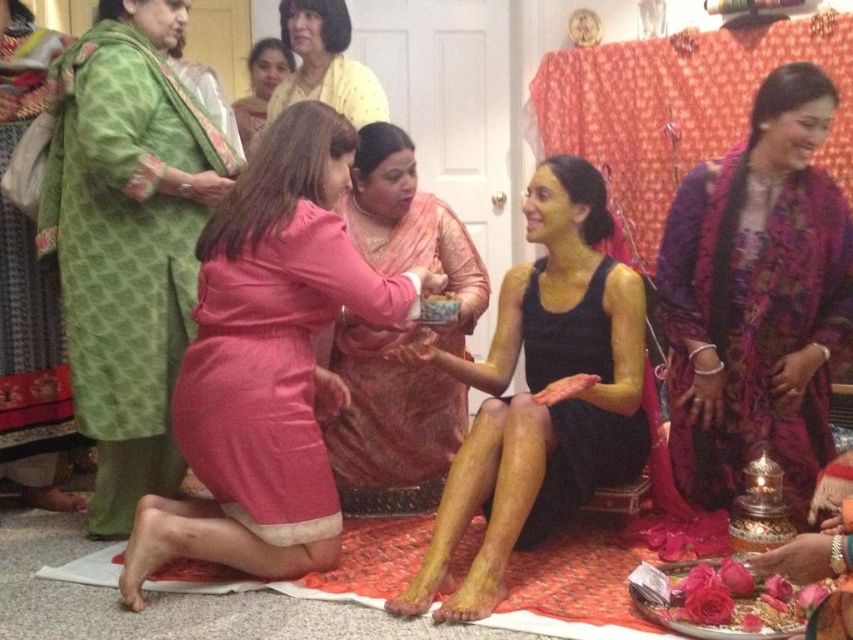
Describe the element at coordinates (399, 339) in the screenshot. I see `pink silk saree at center` at that location.

Does pink silk saree at center lie in front of black matte dress at center?

No.

Which is behind, point (376, 504) or point (590, 406)?

The point (376, 504) is more distant.

At what (x,y) coordinates should I click in order to perform the action: click on pink silk saree at center. Please return your answer as a coordinate pair (x, y). The width and height of the screenshot is (853, 640). Looking at the image, I should click on (399, 339).

Is yellow clay body at center above matte yellow skin at center?

No, yellow clay body at center is not above matte yellow skin at center.

Locate an element on the screen. yellow clay body at center is located at coordinates (543, 394).

At what (x,y) coordinates should I click in order to perform the action: click on yellow clay body at center. Please return your answer as a coordinate pair (x, y). Looking at the image, I should click on (543, 394).

Looking at this image, is the position of black matte dress at center more distant than that of matte pink dress at center?

No, it is not.

Which is more to the right, black matte dress at center or matte pink dress at center?

Positioned to the right is black matte dress at center.

Does point (625, 451) lie in front of point (256, 90)?

Yes.

The height and width of the screenshot is (640, 853). In order to click on black matte dress at center in this screenshot , I will do `click(584, 461)`.